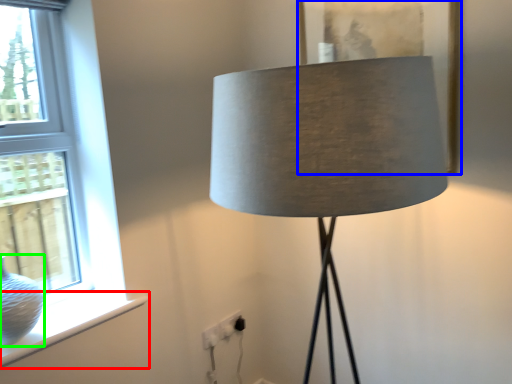
Question: Which object is the farthest from window sill (highlighted by a red box)? Choose among these: picture frame (highlighted by a blue box) or glass vase (highlighted by a green box).

Choices:
 (A) picture frame
 (B) glass vase

Answer: (A)